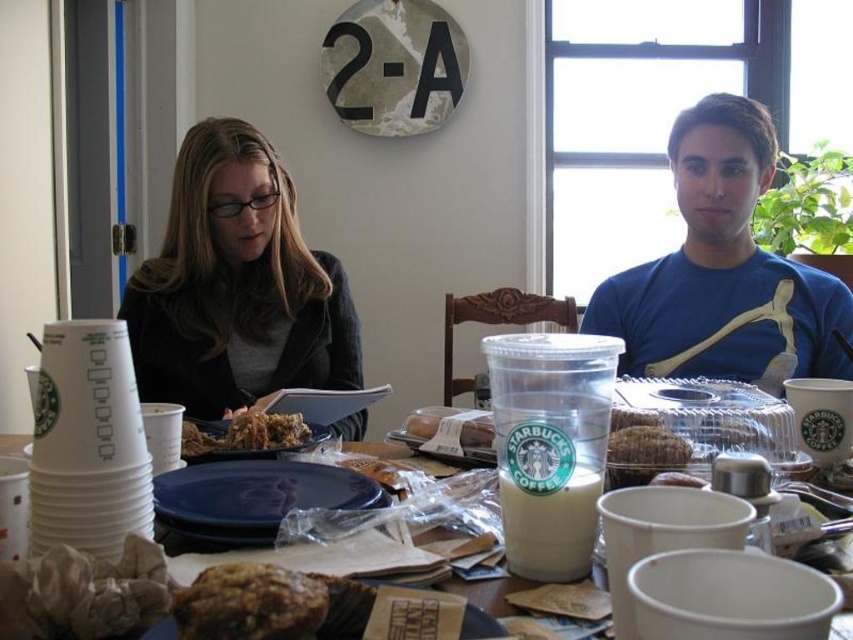
Question: Is matte black jacket at left positioned before blue cotton shirt at upper right?

Choices:
 (A) no
 (B) yes

Answer: (B)

Question: Is brown crumbly pastry at center closer to camera compared to smooth white pastry at center?

Choices:
 (A) yes
 (B) no

Answer: (A)

Question: Which of the following is the closest to the observer?

Choices:
 (A) brown crumbly at center
 (B) blue matte plate at center
 (C) brown crumbly cake at center

Answer: (B)

Question: Is brown crumbly pastry at center to the right of brown crumbly cake at center from the viewer's perspective?

Choices:
 (A) no
 (B) yes

Answer: (A)

Question: Which point is closer to the camera?

Choices:
 (A) matte brown bread at center
 (B) smooth white pastry at center
 (C) brown crumbly at center

Answer: (B)

Question: Which point is farther to the camera?

Choices:
 (A) (285, 577)
 (B) (413, 432)
 (C) (296, 468)

Answer: (B)